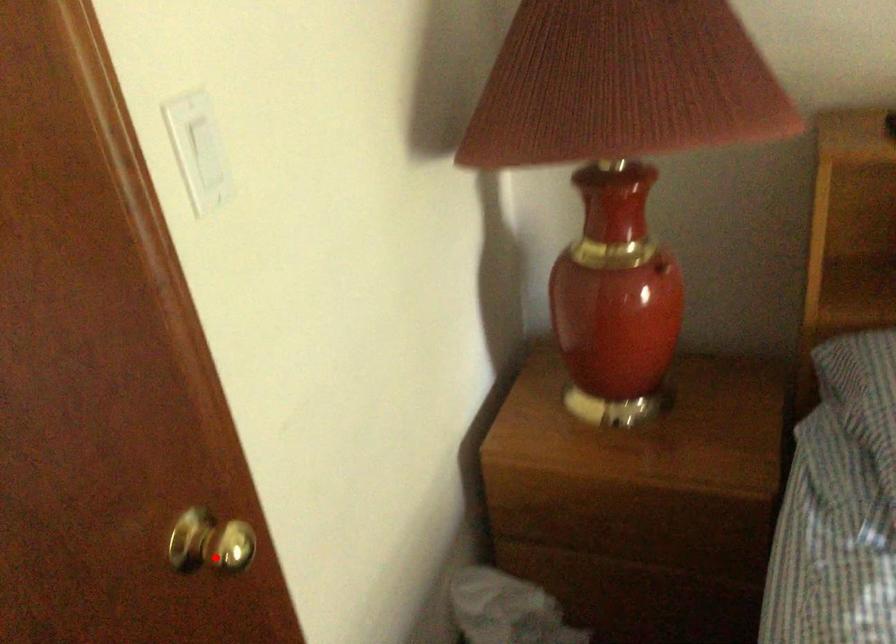
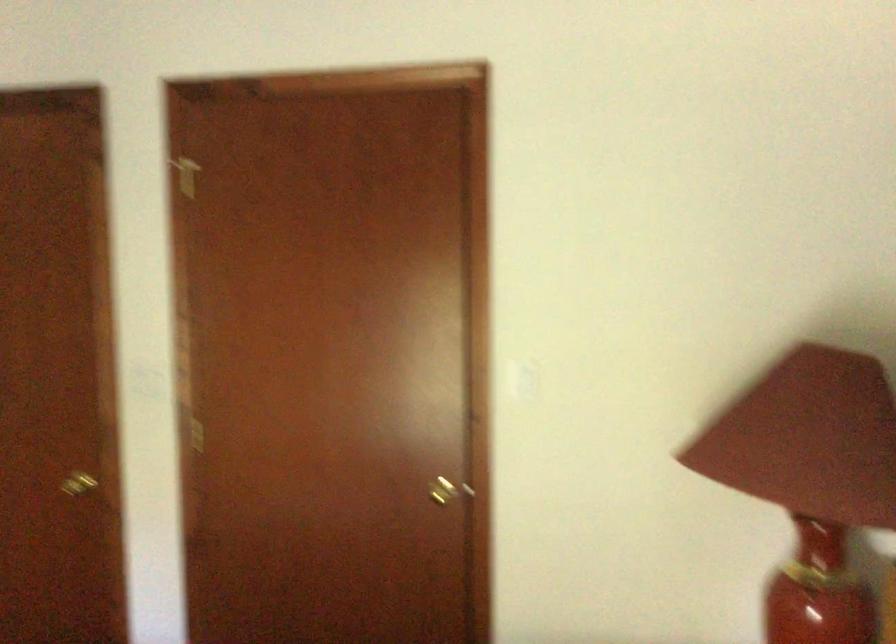
Question: I am providing you with two images of the same scene from different viewpoints. Image1 has a red point marked. In image2, the corresponding 3D location appears at what relative position? Reply with the corresponding letter.

Choices:
 (A) Closer
 (B) Farther

Answer: (B)